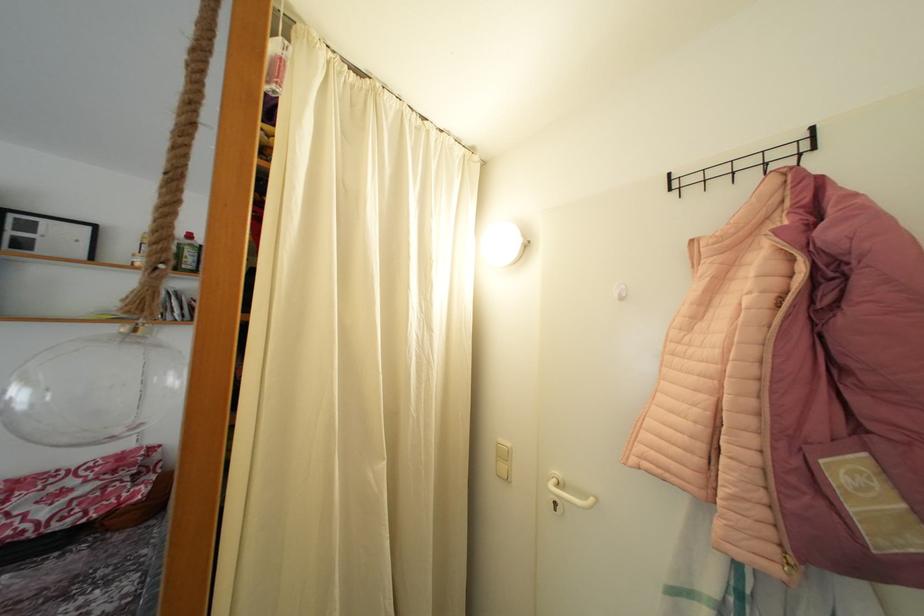
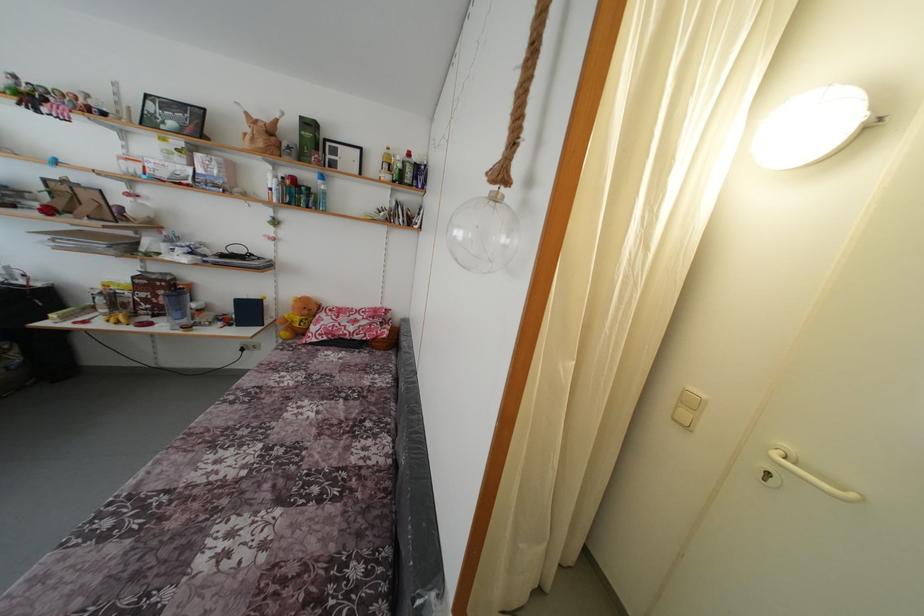
Based on the continuous images, in which direction is the camera rotating?

The camera rotated toward left-down.